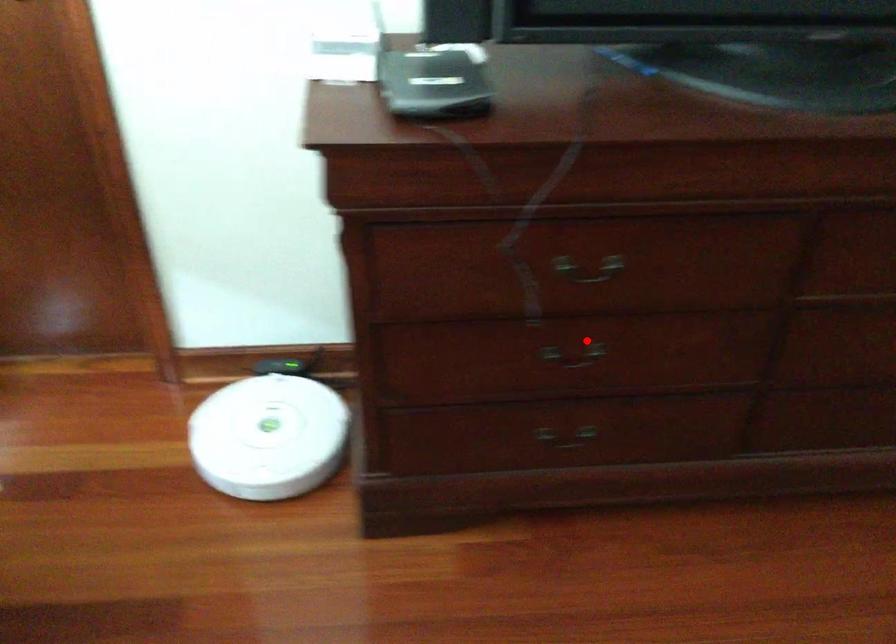
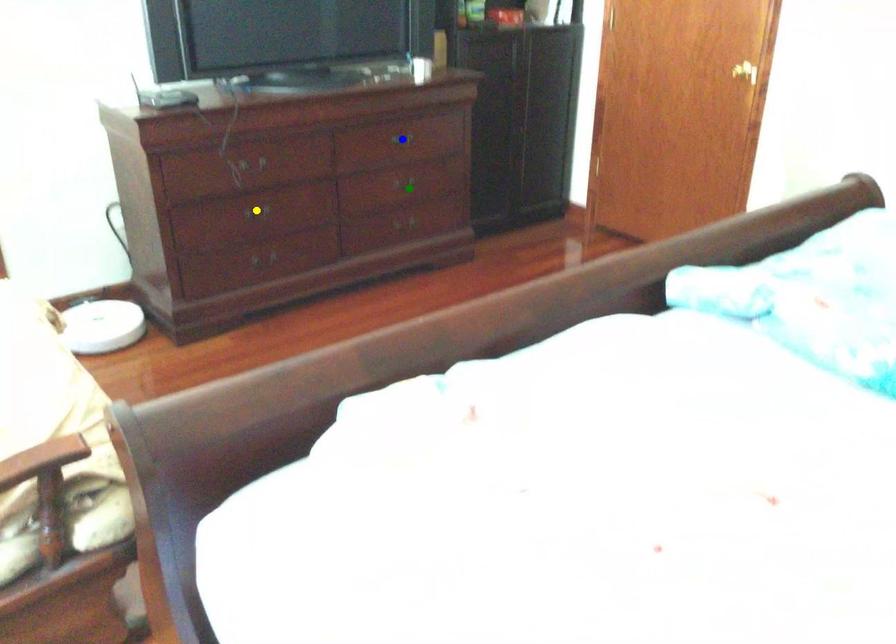
Question: I am providing you with two images of the same scene from different viewpoints. A red point is marked on the first image. You are given multiple points on the second image. Which point in image 2 is actually the same real-world point as the red point in image 1?

Choices:
 (A) blue point
 (B) yellow point
 (C) green point

Answer: (B)